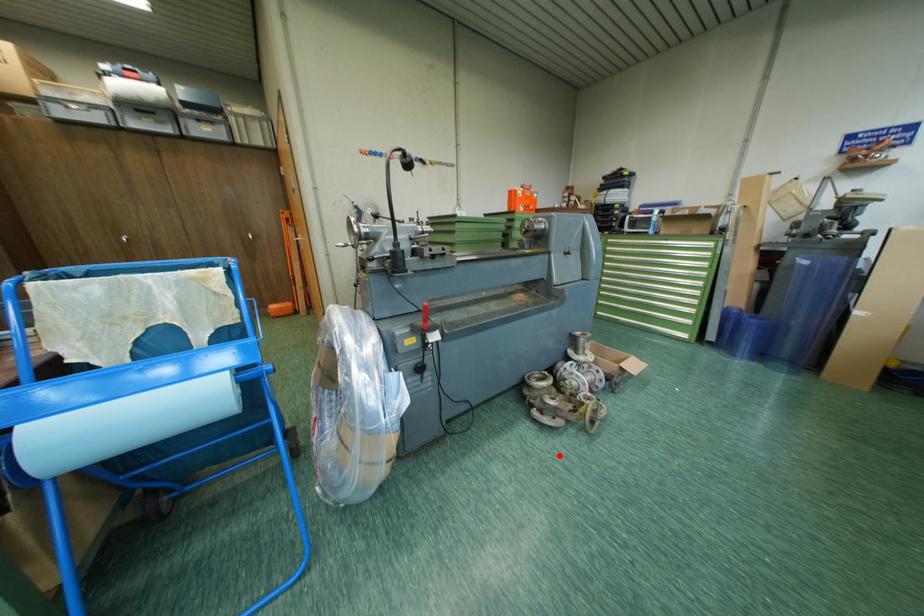
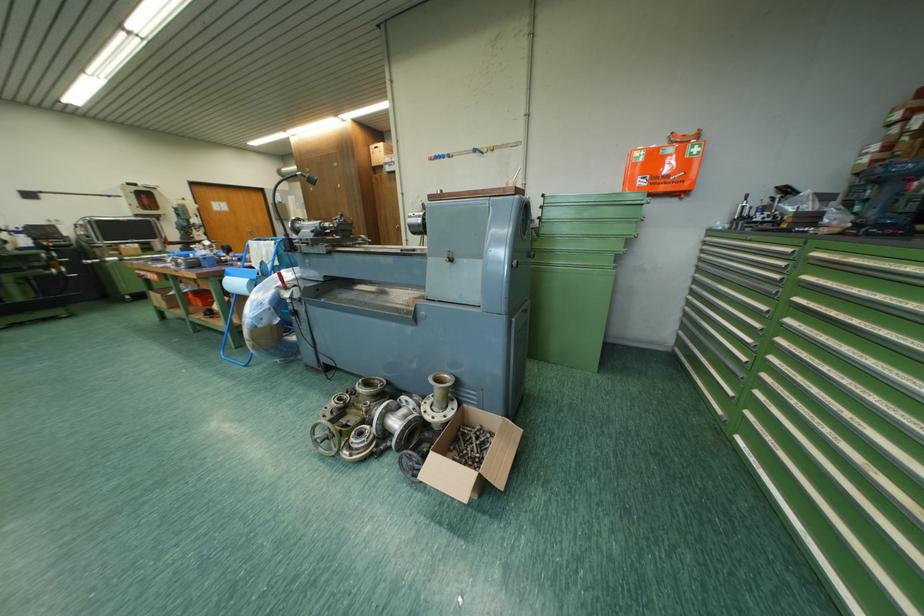
Question: I am providing you with two images of the same scene from different viewpoints. In image1, a red point is highlighted. Considering the same 3D point in image2, which of the following is correct?

Choices:
 (A) It is closer
 (B) It is farther

Answer: (B)